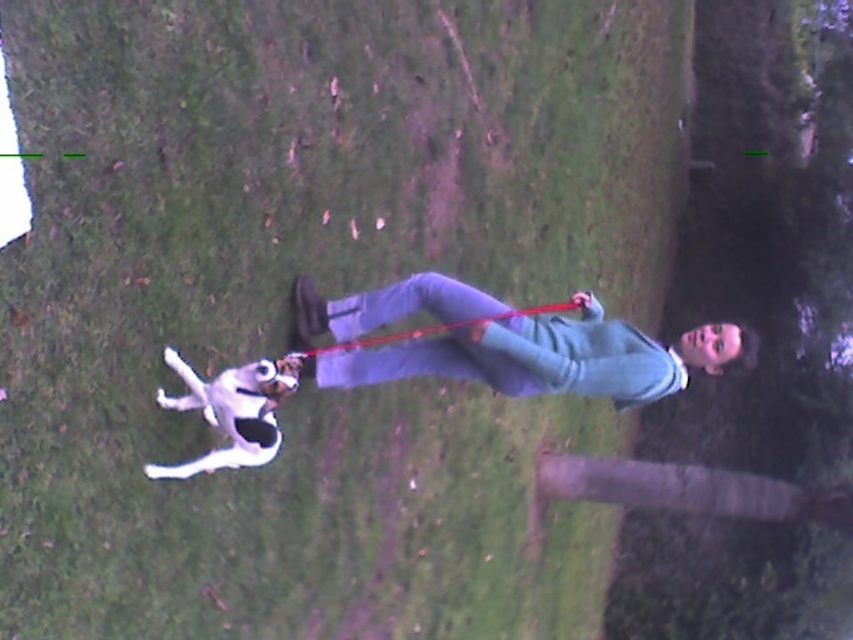
Question: Estimate the real-world distances between objects in this image. Which object is farther from the denim pants at center?

Choices:
 (A) black fabric leash at center
 (B) black fabric neckband at center

Answer: (A)

Question: Which object is positioned farthest from the black fabric leash at center?

Choices:
 (A) denim pants at center
 (B) black fabric neckband at center

Answer: (B)

Question: Is denim pants at center wider than white fur dog at lower left?

Choices:
 (A) no
 (B) yes

Answer: (B)

Question: Does white fur dog at lower left come in front of black fabric neckband at center?

Choices:
 (A) no
 (B) yes

Answer: (B)

Question: Is white fur dog at lower left thinner than black fabric leash at center?

Choices:
 (A) yes
 (B) no

Answer: (A)

Question: Considering the real-world distances, which object is closest to the white fur dog at lower left?

Choices:
 (A) black fabric neckband at center
 (B) black fabric leash at center
 (C) denim pants at center

Answer: (B)